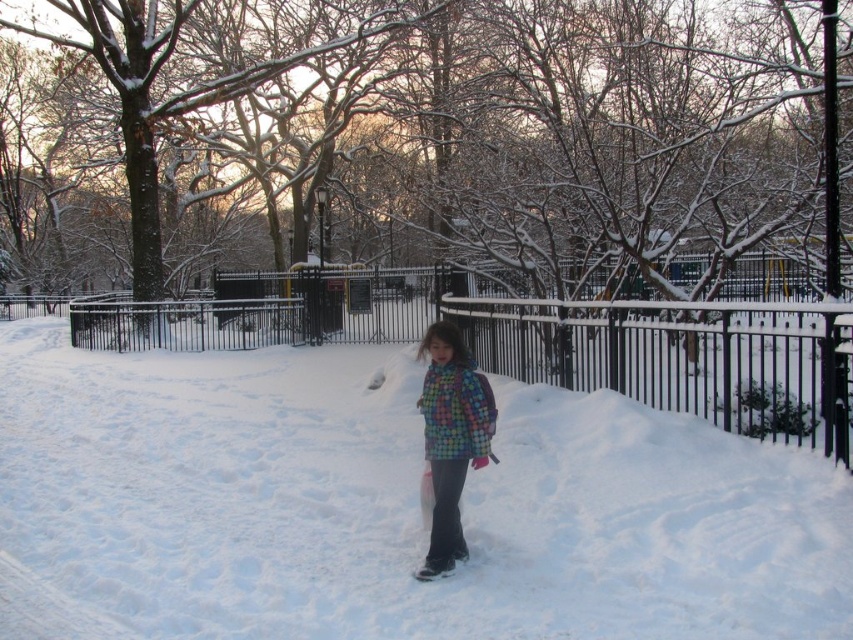
Can you confirm if white fluffy snow at center is positioned to the left of black metal fence at center?

No, white fluffy snow at center is not to the left of black metal fence at center.

Is white fluffy snow at center above black metal fence at center?

No.

Between point (167, 400) and point (813, 384), which one is positioned behind?

The point (167, 400) is more distant.

In order to click on white fluffy snow at center in this screenshot , I will do `click(387, 508)`.

Is black metal fence at center positioned behind multicolored quilted jacket at center?

Yes, it is behind multicolored quilted jacket at center.

Who is lower down, black metal fence at center or multicolored quilted jacket at center?

multicolored quilted jacket at center

Who is more forward, (695, 316) or (442, 424)?

Point (442, 424)

What are the coordinates of `black metal fence at center` in the screenshot? It's located at (651, 353).

Based on the photo, does white fluffy snow at center appear on the right side of multicolored quilted jacket at center?

Incorrect, white fluffy snow at center is not on the right side of multicolored quilted jacket at center.

Is point (412, 422) positioned before point (436, 534)?

No, it is not.

The height and width of the screenshot is (640, 853). I want to click on white fluffy snow at center, so click(387, 508).